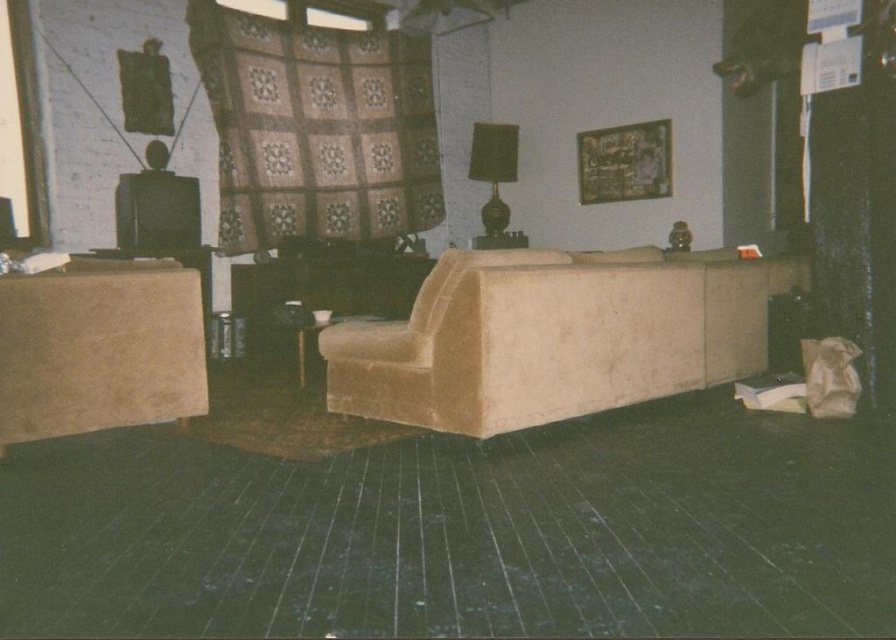
Is point (565, 346) in front of point (104, 362)?

No.

Is beige velvety couch at center thinner than suede beige ottoman at left?

No.

Is point (556, 346) positioned in front of point (90, 419)?

That is False.

Locate an element on the screen. beige velvety couch at center is located at coordinates (554, 337).